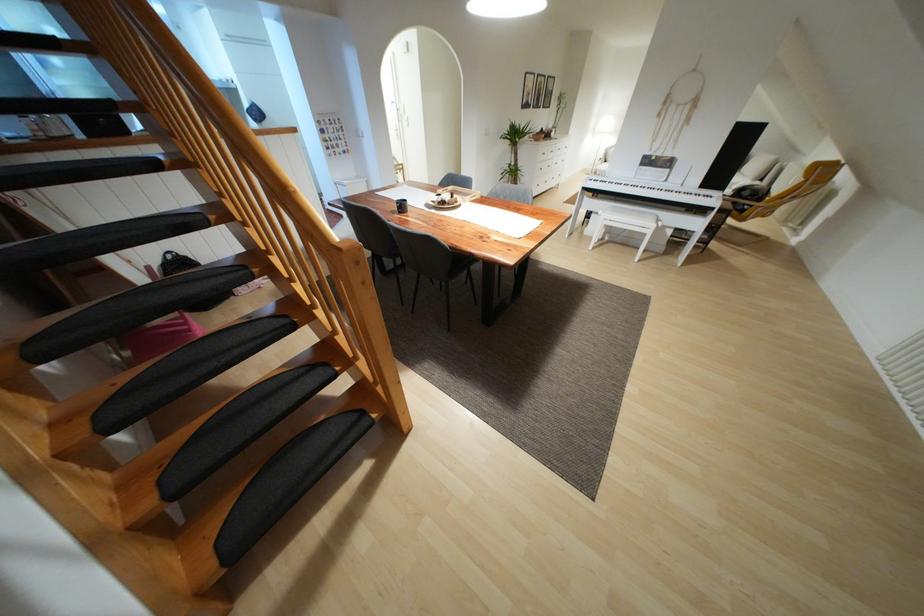
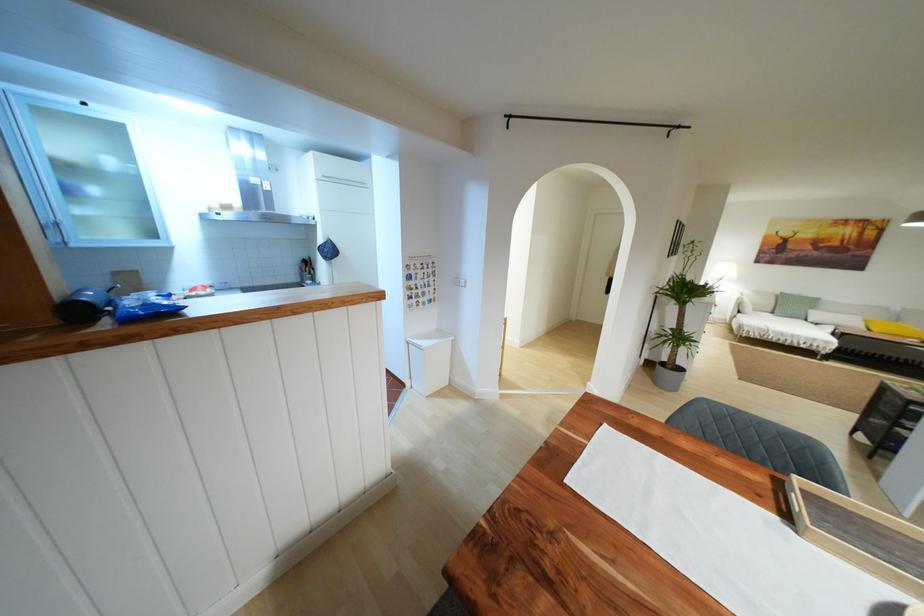
The images are taken continuously from a first-person perspective. In which direction are you moving?

The cameraman walked toward left, forward.